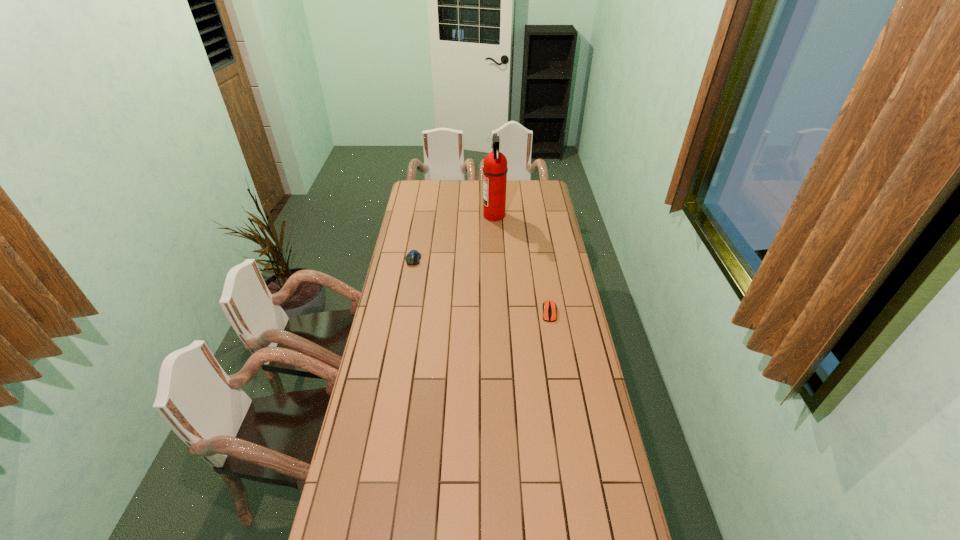
Find the location of a particular element. This screenshot has width=960, height=540. the second object from left to right is located at coordinates (495, 169).

Identify the location of fire extinguisher. (495, 169).

Locate an element on the screen. This screenshot has height=540, width=960. the right computer mouse is located at coordinates (549, 307).

At what (x,y) coordinates should I click in order to perform the action: click on the rightmost object. Please return your answer as a coordinate pair (x, y). Looking at the image, I should click on (549, 307).

Locate an element on the screen. This screenshot has width=960, height=540. the leftmost object is located at coordinates (413, 257).

This screenshot has width=960, height=540. What are the coordinates of `the left computer mouse` in the screenshot? It's located at click(413, 257).

Locate an element on the screen. vacant area situated 0.160m on the side of the second object from right to left near the handle is located at coordinates (454, 215).

Locate an element on the screen. free space located on the side of the second object from right to left near the handle is located at coordinates (460, 215).

At what (x,y) coordinates should I click in order to perform the action: click on blank space located on the side of the second object from right to left near the handle. Please return your answer as a coordinate pair (x, y). Looking at the image, I should click on (463, 215).

Find the location of `free space located 0.240m on the front of the rightmost object`. free space located 0.240m on the front of the rightmost object is located at coordinates (559, 368).